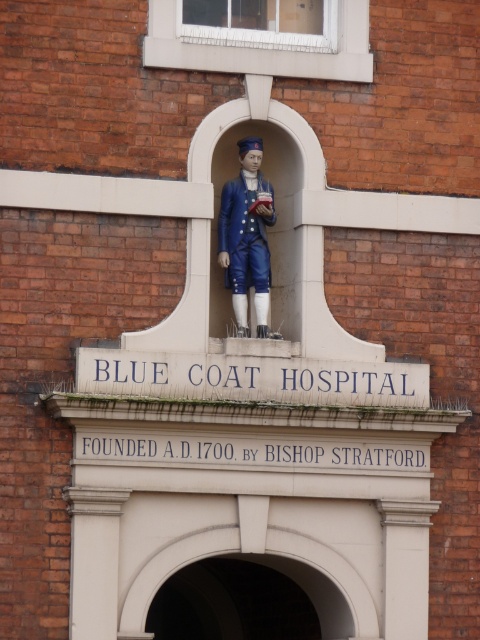
Can you confirm if white stone arch at center is positioned to the left of matte blue uniform at center?

Yes, white stone arch at center is to the left of matte blue uniform at center.

Is point (176, 608) in front of point (228, 221)?

That is False.

Locate an element on the screen. white stone arch at center is located at coordinates (249, 602).